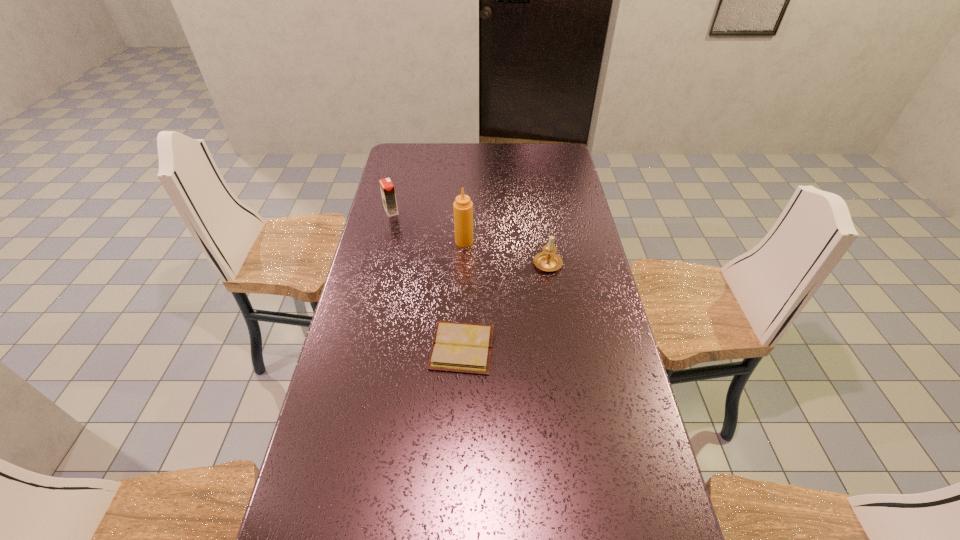
Where is `free spot between the diary and the rightmost object`? This screenshot has width=960, height=540. free spot between the diary and the rightmost object is located at coordinates (505, 305).

The width and height of the screenshot is (960, 540). What are the coordinates of `empty space between the second farthest object and the diary` in the screenshot? It's located at pyautogui.click(x=463, y=295).

This screenshot has width=960, height=540. I want to click on vacant space in between the farthest object and the shortest object, so click(426, 280).

Locate an element on the screen. This screenshot has width=960, height=540. vacant space that's between the condiment and the shortest object is located at coordinates (463, 295).

Where is `free space between the second nearest object and the shortest object`? This screenshot has width=960, height=540. free space between the second nearest object and the shortest object is located at coordinates (505, 305).

Where is `vacant area that lies between the diary and the rightmost object`? vacant area that lies between the diary and the rightmost object is located at coordinates tap(505, 305).

Where is `free space that is in between the candle holder and the condiment`? The image size is (960, 540). free space that is in between the candle holder and the condiment is located at coordinates (506, 252).

Locate an element on the screen. This screenshot has height=540, width=960. free spot between the condiment and the diary is located at coordinates (463, 295).

Point out which object is positioned as the third nearest to the condiment. Please provide its 2D coordinates. Your answer should be formatted as a tuple, i.e. [(x, y)], where the tuple contains the x and y coordinates of a point satisfying the conditions above.

[(457, 347)]

Where is `object that can be found as the closest to the orange juice`? object that can be found as the closest to the orange juice is located at coordinates (463, 207).